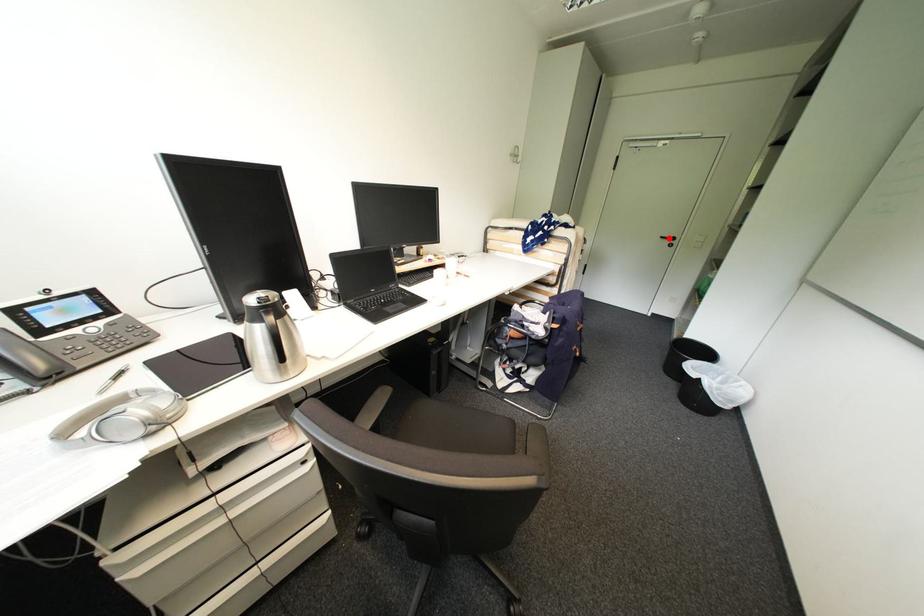
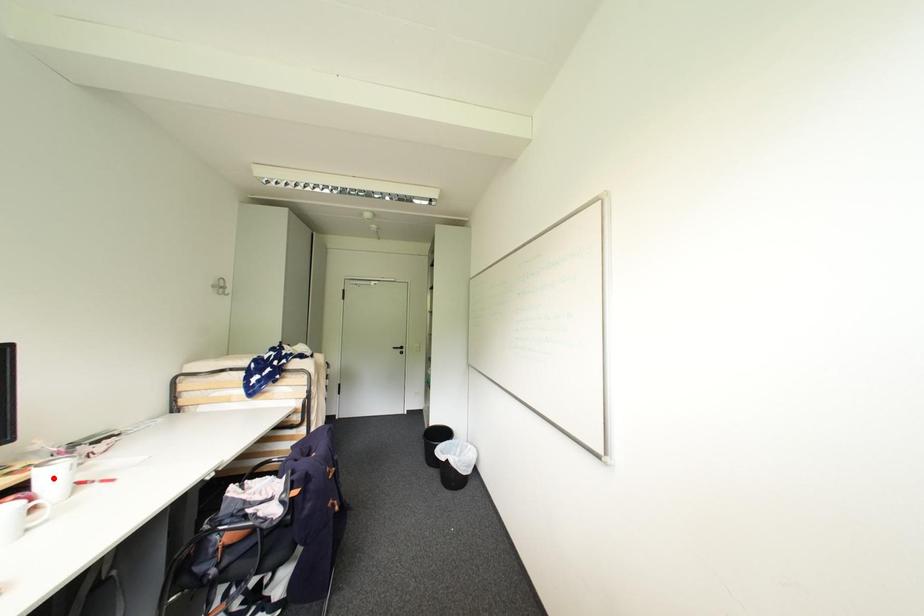
I am providing you with two images of the same scene from different viewpoints. A red point is marked on the first image and another point is marked on the second image. Is the marked point in image1 the same physical position as the marked point in image2?

No